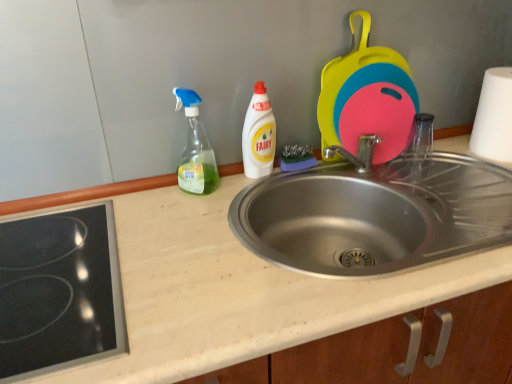
You are a GUI agent. You are given a task and a screenshot of the screen. Output one action in this format:
    pyautogui.click(x=<x>, y=<y>)
    Task: Click on the free point to the left of transparent plastic spray bottle at center, the 2th bottle in the right-to-left sequence
    Image resolution: width=512 pixels, height=384 pixels.
    Given the screenshot: What is the action you would take?
    pyautogui.click(x=136, y=203)